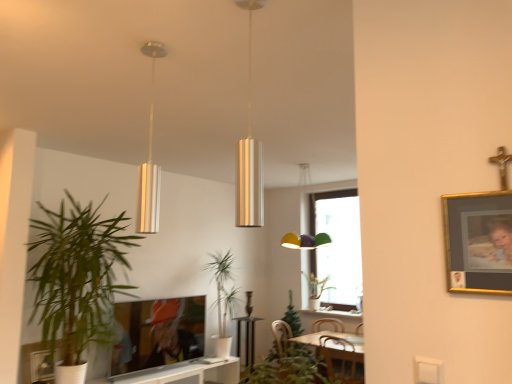
Question: Is wooden swivel chair at lower center taller than green leafy plant at left, the third houseplant from the back?

Choices:
 (A) yes
 (B) no

Answer: (B)

Question: Would you consider wooden swivel chair at lower center to be distant from green leafy plant at left, positioned as the 4th houseplant in right-to-left order?

Choices:
 (A) yes
 (B) no

Answer: (A)

Question: From the image's perspective, is wooden swivel chair at lower center beneath green leafy plant at left, positioned as the 4th houseplant in right-to-left order?

Choices:
 (A) yes
 (B) no

Answer: (A)

Question: Does wooden swivel chair at lower center have a greater width compared to green leafy plant at left, the 2th houseplant when ordered from front to back?

Choices:
 (A) yes
 (B) no

Answer: (B)

Question: Is wooden swivel chair at lower center facing towards green leafy plant at left, the 2th houseplant when ordered from front to back?

Choices:
 (A) yes
 (B) no

Answer: (B)

Question: In terms of height, does matte black tv at lower center, the 2th picture frame viewed from the right, look taller or shorter compared to metallic silver picture frame at lower left, which ranks as the 2th picture frame in front-to-back order?

Choices:
 (A) short
 (B) tall

Answer: (B)

Question: Is matte black tv at lower center, the first picture frame from the bottom, bigger or smaller than metallic silver picture frame at lower left, positioned as the 2th picture frame in bottom-to-top order?

Choices:
 (A) big
 (B) small

Answer: (A)

Question: Is matte black tv at lower center, which ranks as the first picture frame in back-to-front order, situated inside metallic silver picture frame at lower left, positioned as the third picture frame in right-to-left order, or outside?

Choices:
 (A) inside
 (B) outside

Answer: (B)

Question: Visually, is matte black tv at lower center, marked as the 3th picture frame in a front-to-back arrangement, positioned to the left or to the right of metallic silver picture frame at lower left, acting as the 2th picture frame starting from the back?

Choices:
 (A) right
 (B) left

Answer: (A)

Question: Choose the correct answer: Is metallic silver picture frame at lower left, the first picture frame viewed from the left, inside metallic silver pendant light at upper center, the 2th lamp from the front, or outside it?

Choices:
 (A) inside
 (B) outside

Answer: (B)

Question: From a real-world perspective, is metallic silver picture frame at lower left, acting as the 2th picture frame starting from the back, above or below metallic silver pendant light at upper center, marked as the 1th lamp in a left-to-right arrangement?

Choices:
 (A) above
 (B) below

Answer: (B)

Question: From the image's perspective, is metallic silver picture frame at lower left, the first picture frame viewed from the left, positioned above or below metallic silver pendant light at upper center, arranged as the 1th lamp when viewed from the back?

Choices:
 (A) below
 (B) above

Answer: (A)

Question: Based on their positions, is metallic silver picture frame at lower left, the 2th picture frame when ordered from top to bottom, located to the left or right of metallic silver pendant light at upper center, arranged as the 1th lamp when viewed from the back?

Choices:
 (A) right
 (B) left

Answer: (B)

Question: From a real-world perspective, is wooden swivel chair at lower center positioned above or below green leafy plant at lower center, the third houseplant from the left?

Choices:
 (A) above
 (B) below

Answer: (B)

Question: Is wooden swivel chair at lower center to the left or to the right of green leafy plant at lower center, the 1th houseplant in the front-to-back sequence, in the image?

Choices:
 (A) right
 (B) left

Answer: (A)